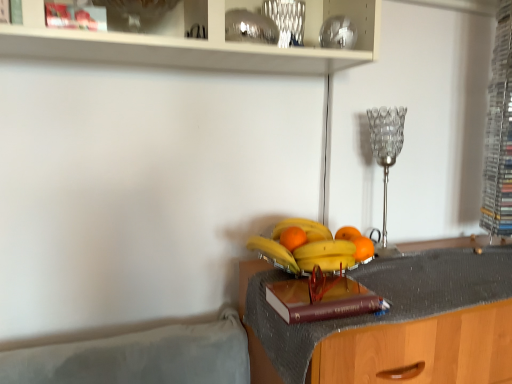
Question: Is yellow matte banana at center, positioned as the 1th banana in top-to-bottom order, oriented away from orange matte at center?

Choices:
 (A) no
 (B) yes

Answer: (A)

Question: Would you say yellow matte banana at center, positioned as the 1th banana in top-to-bottom order, contains orange matte at center?

Choices:
 (A) no
 (B) yes

Answer: (A)

Question: From the image's perspective, would you say yellow matte banana at center, acting as the third banana starting from the bottom, is positioned over orange matte at center?

Choices:
 (A) yes
 (B) no

Answer: (A)

Question: From a real-world perspective, is yellow matte banana at center, acting as the third banana starting from the bottom, physically above orange matte at center?

Choices:
 (A) no
 (B) yes

Answer: (B)

Question: From the image's perspective, is yellow matte banana at center, acting as the third banana starting from the bottom, located beneath orange matte at center?

Choices:
 (A) yes
 (B) no

Answer: (B)

Question: Considering the positions of orange matte at center and shiny metallic vase at upper center in the image, is orange matte at center bigger or smaller than shiny metallic vase at upper center?

Choices:
 (A) small
 (B) big

Answer: (A)

Question: Is orange matte at center situated inside shiny metallic vase at upper center or outside?

Choices:
 (A) inside
 (B) outside

Answer: (B)

Question: In the image, is orange matte at center on the left side or the right side of shiny metallic vase at upper center?

Choices:
 (A) left
 (B) right

Answer: (B)

Question: Is point (361, 244) positioned closer to the camera than point (287, 34)?

Choices:
 (A) farther
 (B) closer

Answer: (B)

Question: From a real-world perspective, relative to yellow matte banana at center, acting as the third banana starting from the bottom, is shiny metallic vase at upper center vertically above or below?

Choices:
 (A) below
 (B) above

Answer: (B)

Question: Considering their positions, is shiny metallic vase at upper center located in front of or behind yellow matte banana at center, positioned as the 1th banana in top-to-bottom order?

Choices:
 (A) front
 (B) behind

Answer: (B)

Question: Is shiny metallic vase at upper center situated inside yellow matte banana at center, acting as the third banana starting from the bottom, or outside?

Choices:
 (A) inside
 (B) outside

Answer: (B)

Question: Looking at the image, does shiny metallic vase at upper center seem bigger or smaller compared to yellow matte banana at center, acting as the third banana starting from the bottom?

Choices:
 (A) big
 (B) small

Answer: (A)

Question: Looking at their shapes, would you say orange matte at center is wider or thinner than maroon leather book at center?

Choices:
 (A) wide
 (B) thin

Answer: (B)

Question: From the image's perspective, is orange matte at center above or below maroon leather book at center?

Choices:
 (A) below
 (B) above

Answer: (B)